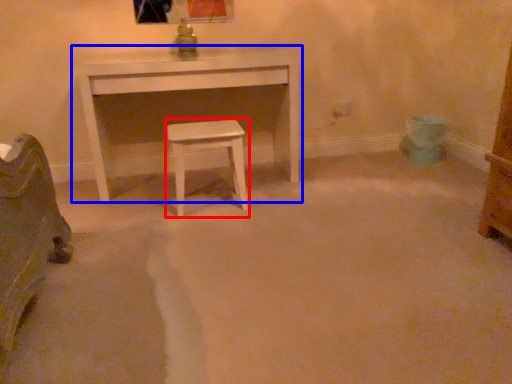
Question: Which object is further to the camera taking this photo, stool (highlighted by a red box) or table (highlighted by a blue box)?

Choices:
 (A) stool
 (B) table

Answer: (B)